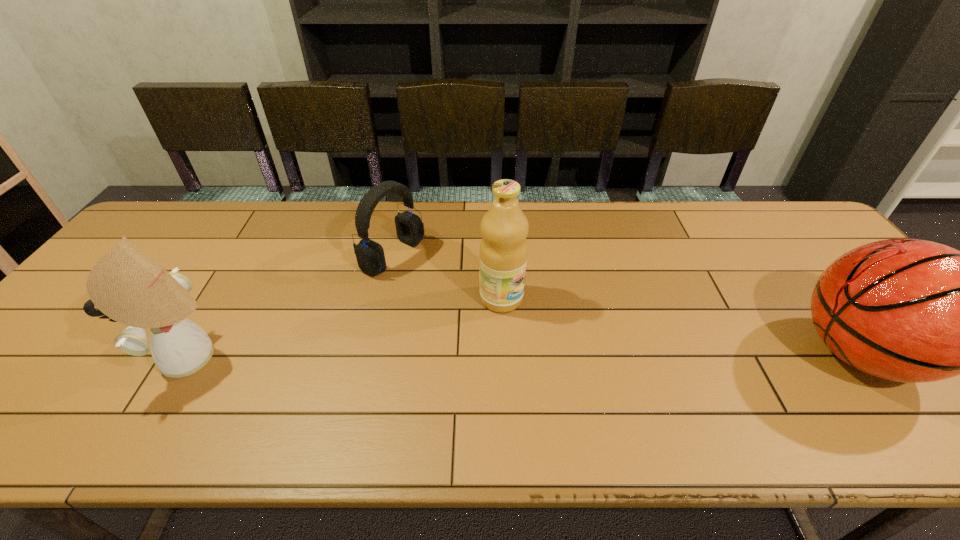
Image resolution: width=960 pixels, height=540 pixels. I want to click on free space on the desktop that is between the leftmost object and the basketball and is positioned on the headband of the farthest object, so pos(593,355).

Identify the location of vacant space on the desktop that is between the doll and the rightmost object and is positioned on the label of the third object from left to right. The image size is (960, 540). (607, 355).